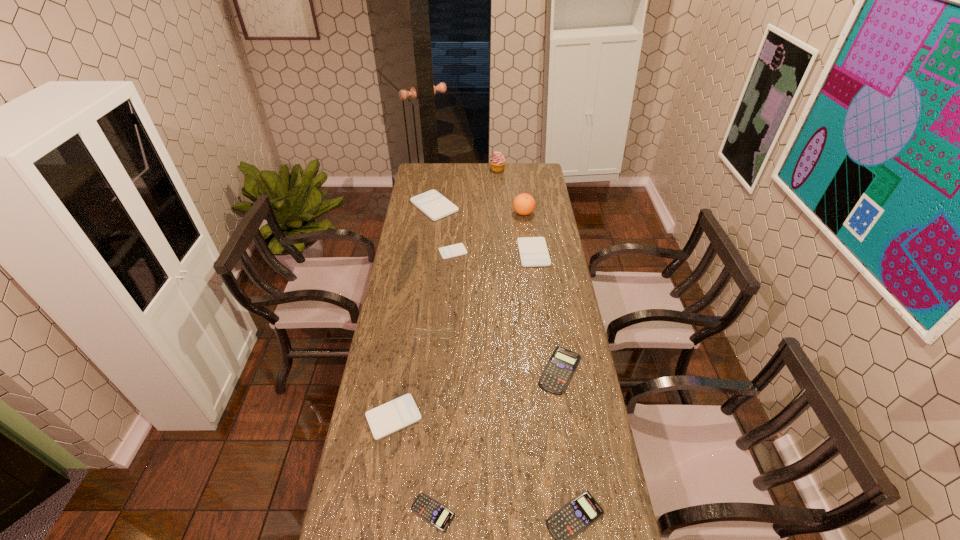
Find the location of `vacant space located on the right of the third tallest calculator`. vacant space located on the right of the third tallest calculator is located at coordinates (497, 417).

Identify the location of vacant space situated 0.120m on the right of the smallest white calculator. The width and height of the screenshot is (960, 540). click(494, 252).

Where is `vacant space positioned on the left of the farthest blue calculator`? The width and height of the screenshot is (960, 540). vacant space positioned on the left of the farthest blue calculator is located at coordinates (456, 370).

This screenshot has width=960, height=540. In order to click on free space located on the back of the shortest calculator in this screenshot , I will do `click(441, 413)`.

I want to click on object that is at the far edge, so click(x=497, y=162).

The height and width of the screenshot is (540, 960). Find the location of `spectacles located in the left edge section of the desktop`. spectacles located in the left edge section of the desktop is located at coordinates (446, 333).

The image size is (960, 540). In order to click on orange positioned at the right edge in this screenshot , I will do `click(524, 204)`.

The image size is (960, 540). I want to click on free space at the far edge, so (x=509, y=167).

Where is `vacant space at the left edge of the desktop`? The width and height of the screenshot is (960, 540). vacant space at the left edge of the desktop is located at coordinates (431, 241).

Where is `blank space at the right edge of the desktop`? This screenshot has width=960, height=540. blank space at the right edge of the desktop is located at coordinates (612, 505).